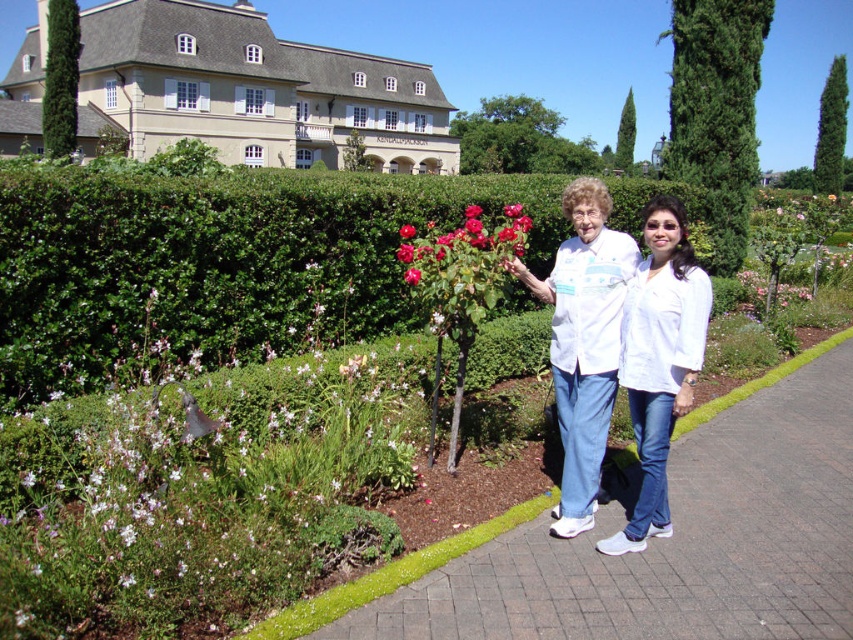
Question: Observing the image, what is the correct spatial positioning of white textured shirt at center in reference to shiny red rose at center?

Choices:
 (A) below
 (B) above

Answer: (A)

Question: Considering the real-world distances, which object is farthest from the shiny red rose at center?

Choices:
 (A) brick pavement at center
 (B) green leafy bush at upper right
 (C) green leafy hedge at center

Answer: (B)

Question: Is brick pavement at center smaller than white matte shirt at center?

Choices:
 (A) yes
 (B) no

Answer: (A)

Question: Considering the real-world distances, which object is farthest from the shiny red rose at center?

Choices:
 (A) white cotton shirt at center
 (B) green leafy bush at upper right
 (C) brick pavement at center

Answer: (B)

Question: Does green leafy hedge at center lie in front of green leafy bush at upper right?

Choices:
 (A) yes
 (B) no

Answer: (A)

Question: Which point is farther to the camera?

Choices:
 (A) white matte shirt at center
 (B) white matte lab coat at center
 (C) green leafy bush at upper right

Answer: (C)